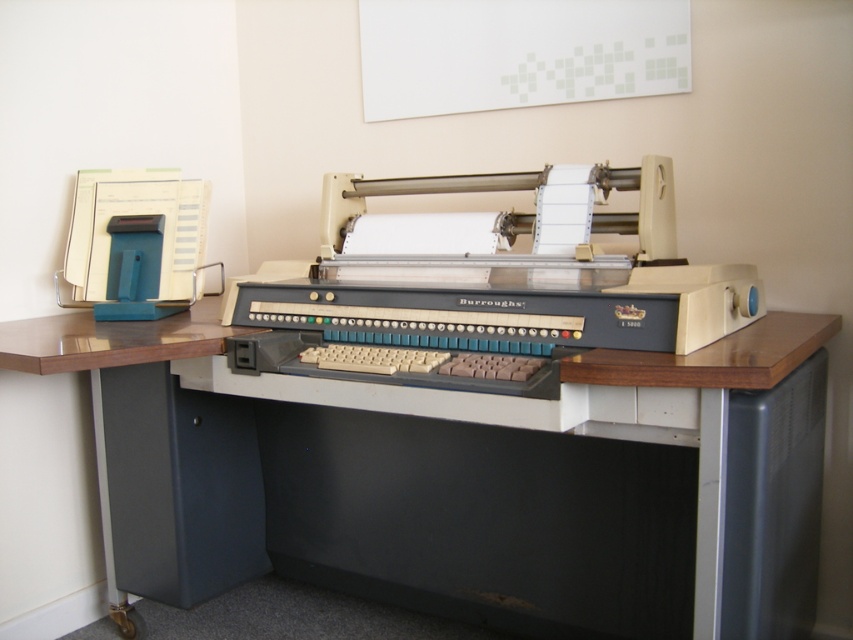
Is point (440, 388) closer to viewer compared to point (492, 276)?

Yes.

Is point (753, 573) positioned after point (704, 316)?

No, it is in front of (704, 316).

Locate an element on the screen. wooden desk at center is located at coordinates (456, 477).